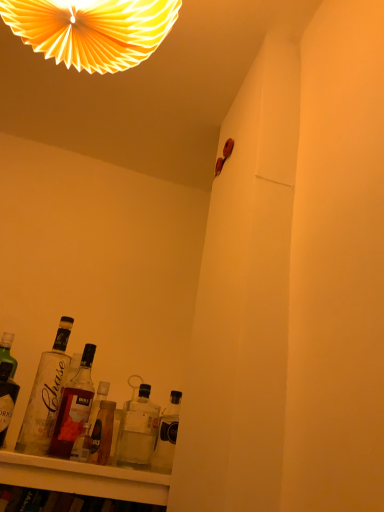
What do you see at coordinates (138, 430) in the screenshot? I see `translucent glass bottle at lower center, the 2th bottle when ordered from right to left` at bounding box center [138, 430].

Describe the element at coordinates (74, 407) in the screenshot. I see `clear glass bottle at lower left, positioned as the second bottle in left-to-right order` at that location.

The image size is (384, 512). Describe the element at coordinates (102, 433) in the screenshot. I see `translucent glass bottle at lower left, which is counted as the 3th bottle, starting from the right` at that location.

Find the location of `translucent glass bottle at lower right, marked as the 1th bottle in a right-to-left arrangement`. translucent glass bottle at lower right, marked as the 1th bottle in a right-to-left arrangement is located at coordinates (167, 435).

What do you see at coordinates (92, 30) in the screenshot? The width and height of the screenshot is (384, 512). I see `yellow paper fan at upper center` at bounding box center [92, 30].

Find the location of a particular element. translucent glass bottle at lower center, arranged as the 4th bottle when viewed from the left is located at coordinates (138, 430).

In the scene shown: Between translucent glass bottle at lower center, arranged as the 4th bottle when viewed from the left, and clear glass bottle at lower left, positioned as the second bottle in left-to-right order, which one has more height?

clear glass bottle at lower left, positioned as the second bottle in left-to-right order.

Is translucent glass bottle at lower center, the 2th bottle when ordered from right to left, positioned behind clear glass bottle at lower left, positioned as the second bottle in left-to-right order?

No, the depth of translucent glass bottle at lower center, the 2th bottle when ordered from right to left, is less than that of clear glass bottle at lower left, positioned as the second bottle in left-to-right order.

From the image's perspective, does translucent glass bottle at lower center, the 2th bottle when ordered from right to left, appear higher than clear glass bottle at lower left, positioned as the 4th bottle in right-to-left order?

No, from the image's perspective, translucent glass bottle at lower center, the 2th bottle when ordered from right to left, is not over clear glass bottle at lower left, positioned as the 4th bottle in right-to-left order.

Does point (42, 50) lie in front of point (166, 433)?

That is True.

Can we say yellow paper fan at upper center lies outside translucent glass bottle at lower right, acting as the fifth bottle starting from the left?

That's correct, yellow paper fan at upper center is outside of translucent glass bottle at lower right, acting as the fifth bottle starting from the left.

Looking at this image, from a real-world perspective, which is physically above, yellow paper fan at upper center or translucent glass bottle at lower right, acting as the fifth bottle starting from the left?

Result: yellow paper fan at upper center, from a real-world perspective.

Measure the distance between yellow paper fan at upper center and translucent glass bottle at lower right, acting as the fifth bottle starting from the left.

yellow paper fan at upper center and translucent glass bottle at lower right, acting as the fifth bottle starting from the left, are 34.50 inches apart from each other.

From a real-world perspective, which is physically below, yellow paper fan at upper center or clear glass bottle at lower left, arranged as the 5th bottle when viewed from the right?

clear glass bottle at lower left, arranged as the 5th bottle when viewed from the right.

From the image's perspective, which one is positioned higher, yellow paper fan at upper center or clear glass bottle at lower left, marked as the 1th bottle in a left-to-right arrangement?

yellow paper fan at upper center, from the image's perspective.

Is translucent glass bottle at lower right, marked as the 1th bottle in a right-to-left arrangement, at the left side of clear glass bottle at lower left, positioned as the 4th bottle in right-to-left order?

In fact, translucent glass bottle at lower right, marked as the 1th bottle in a right-to-left arrangement, is to the right of clear glass bottle at lower left, positioned as the 4th bottle in right-to-left order.

Could you tell me if translucent glass bottle at lower right, marked as the 1th bottle in a right-to-left arrangement, is facing clear glass bottle at lower left, positioned as the 4th bottle in right-to-left order?

No, translucent glass bottle at lower right, marked as the 1th bottle in a right-to-left arrangement, is not oriented towards clear glass bottle at lower left, positioned as the 4th bottle in right-to-left order.

Considering the sizes of translucent glass bottle at lower right, marked as the 1th bottle in a right-to-left arrangement, and clear glass bottle at lower left, positioned as the 4th bottle in right-to-left order, in the image, is translucent glass bottle at lower right, marked as the 1th bottle in a right-to-left arrangement, taller or shorter than clear glass bottle at lower left, positioned as the 4th bottle in right-to-left order,?

translucent glass bottle at lower right, marked as the 1th bottle in a right-to-left arrangement, is shorter than clear glass bottle at lower left, positioned as the 4th bottle in right-to-left order.

From the image's perspective, does translucent glass bottle at lower right, marked as the 1th bottle in a right-to-left arrangement, appear higher than clear glass bottle at lower left, positioned as the second bottle in left-to-right order?

Actually, translucent glass bottle at lower right, marked as the 1th bottle in a right-to-left arrangement, appears below clear glass bottle at lower left, positioned as the second bottle in left-to-right order, in the image.

Is clear glass bottle at lower left, marked as the 1th bottle in a left-to-right arrangement, in contact with clear glass bottle at lower left, positioned as the second bottle in left-to-right order?

Yes, clear glass bottle at lower left, marked as the 1th bottle in a left-to-right arrangement, is in contact with clear glass bottle at lower left, positioned as the second bottle in left-to-right order.

Does clear glass bottle at lower left, arranged as the 5th bottle when viewed from the right, turn towards clear glass bottle at lower left, positioned as the second bottle in left-to-right order?

No, clear glass bottle at lower left, arranged as the 5th bottle when viewed from the right, is not oriented towards clear glass bottle at lower left, positioned as the second bottle in left-to-right order.

Looking at this image, can we say clear glass bottle at lower left, arranged as the 5th bottle when viewed from the right, lies outside clear glass bottle at lower left, positioned as the second bottle in left-to-right order?

Yes.

In terms of width, does translucent glass bottle at lower right, marked as the 1th bottle in a right-to-left arrangement, look wider or thinner when compared to yellow paper fan at upper center?

translucent glass bottle at lower right, marked as the 1th bottle in a right-to-left arrangement, is thinner than yellow paper fan at upper center.

From a real-world perspective, is translucent glass bottle at lower right, acting as the fifth bottle starting from the left, below yellow paper fan at upper center?

Yes, from a real-world perspective, translucent glass bottle at lower right, acting as the fifth bottle starting from the left, is under yellow paper fan at upper center.

Which is closer, (156, 445) or (113, 53)?

The point (113, 53) is closer.

Consider the image. Can you see translucent glass bottle at lower right, acting as the fifth bottle starting from the left, touching yellow paper fan at upper center?

translucent glass bottle at lower right, acting as the fifth bottle starting from the left, is not next to yellow paper fan at upper center, and they're not touching.

Considering the relative sizes of yellow paper fan at upper center and translucent glass bottle at lower left, the 3th bottle from the left, in the image provided, is yellow paper fan at upper center wider than translucent glass bottle at lower left, the 3th bottle from the left,?

Indeed, yellow paper fan at upper center has a greater width compared to translucent glass bottle at lower left, the 3th bottle from the left.

Is translucent glass bottle at lower left, which is counted as the 3th bottle, starting from the right, at the back of yellow paper fan at upper center?

No, yellow paper fan at upper center is not facing the opposite direction of translucent glass bottle at lower left, which is counted as the 3th bottle, starting from the right.

Is yellow paper fan at upper center beside translucent glass bottle at lower left, which is counted as the 3th bottle, starting from the right?

There is a gap between yellow paper fan at upper center and translucent glass bottle at lower left, which is counted as the 3th bottle, starting from the right.

Find the location of a particular element. Image resolution: width=384 pixels, height=512 pixels. the 2nd bottle in front of the clear glass bottle at lower left, positioned as the second bottle in left-to-right order is located at coordinates (138, 430).

You are a GUI agent. You are given a task and a screenshot of the screen. Output one action in this format:
    pyautogui.click(x=<x>, y=<y>)
    Task: Click on the lamp above the translucent glass bottle at lower right, marked as the 1th bottle in a right-to-left arrangement (from a real-world perspective)
    This screenshot has height=512, width=384.
    Given the screenshot: What is the action you would take?
    pyautogui.click(x=92, y=30)

Considering their positions, is yellow paper fan at upper center positioned further to translucent glass bottle at lower center, the 2th bottle when ordered from right to left, than translucent glass bottle at lower right, marked as the 1th bottle in a right-to-left arrangement?

yellow paper fan at upper center is positioned further to the anchor translucent glass bottle at lower center, the 2th bottle when ordered from right to left.

From the picture: Considering their positions, is clear glass bottle at lower left, positioned as the second bottle in left-to-right order, positioned further to clear glass bottle at lower left, marked as the 1th bottle in a left-to-right arrangement, than translucent glass bottle at lower left, the 3th bottle from the left?

Based on the image, translucent glass bottle at lower left, the 3th bottle from the left, appears to be further to clear glass bottle at lower left, marked as the 1th bottle in a left-to-right arrangement.

Looking at the image, which one is located closer to translucent glass bottle at lower center, the 2th bottle when ordered from right to left, clear glass bottle at lower left, marked as the 1th bottle in a left-to-right arrangement, or yellow paper fan at upper center?

clear glass bottle at lower left, marked as the 1th bottle in a left-to-right arrangement, is positioned closer to the anchor translucent glass bottle at lower center, the 2th bottle when ordered from right to left.

When comparing their distances from clear glass bottle at lower left, positioned as the 4th bottle in right-to-left order, does translucent glass bottle at lower right, acting as the fifth bottle starting from the left, or translucent glass bottle at lower left, which is counted as the 3th bottle, starting from the right, seem closer?

translucent glass bottle at lower left, which is counted as the 3th bottle, starting from the right, lies closer to clear glass bottle at lower left, positioned as the 4th bottle in right-to-left order, than the other object.

Based on their spatial positions, is clear glass bottle at lower left, positioned as the second bottle in left-to-right order, or translucent glass bottle at lower left, which is counted as the 3th bottle, starting from the right, closer to translucent glass bottle at lower right, acting as the fifth bottle starting from the left?

translucent glass bottle at lower left, which is counted as the 3th bottle, starting from the right, is closer to translucent glass bottle at lower right, acting as the fifth bottle starting from the left.

In the scene shown: Looking at the image, which one is located closer to yellow paper fan at upper center, translucent glass bottle at lower left, which is counted as the 3th bottle, starting from the right, or translucent glass bottle at lower center, the 2th bottle when ordered from right to left?

translucent glass bottle at lower center, the 2th bottle when ordered from right to left, is positioned closer to the anchor yellow paper fan at upper center.

Considering their positions, is translucent glass bottle at lower center, the 2th bottle when ordered from right to left, positioned closer to clear glass bottle at lower left, positioned as the second bottle in left-to-right order, than translucent glass bottle at lower left, the 3th bottle from the left?

Among the two, translucent glass bottle at lower left, the 3th bottle from the left, is located nearer to clear glass bottle at lower left, positioned as the second bottle in left-to-right order.

Based on their spatial positions, is yellow paper fan at upper center or translucent glass bottle at lower left, which is counted as the 3th bottle, starting from the right, further from clear glass bottle at lower left, positioned as the second bottle in left-to-right order?

yellow paper fan at upper center is positioned further to the anchor clear glass bottle at lower left, positioned as the second bottle in left-to-right order.

Find the location of a particular element. bottle between yellow paper fan at upper center and clear glass bottle at lower left, positioned as the 4th bottle in right-to-left order, from top to bottom is located at coordinates (45, 395).

Find the location of a particular element. The height and width of the screenshot is (512, 384). bottle situated between translucent glass bottle at lower left, the 3th bottle from the left, and translucent glass bottle at lower right, marked as the 1th bottle in a right-to-left arrangement, from left to right is located at coordinates (138, 430).

I want to click on bottle situated between clear glass bottle at lower left, arranged as the 5th bottle when viewed from the right, and translucent glass bottle at lower left, the 3th bottle from the left, from left to right, so click(74, 407).

You are a GUI agent. You are given a task and a screenshot of the screen. Output one action in this format:
    pyautogui.click(x=<x>, y=<y>)
    Task: Click on the bottle between clear glass bottle at lower left, positioned as the second bottle in left-to-right order, and translucent glass bottle at lower center, the 2th bottle when ordered from right to left, in the horizontal direction
    Image resolution: width=384 pixels, height=512 pixels.
    Given the screenshot: What is the action you would take?
    pyautogui.click(x=102, y=433)